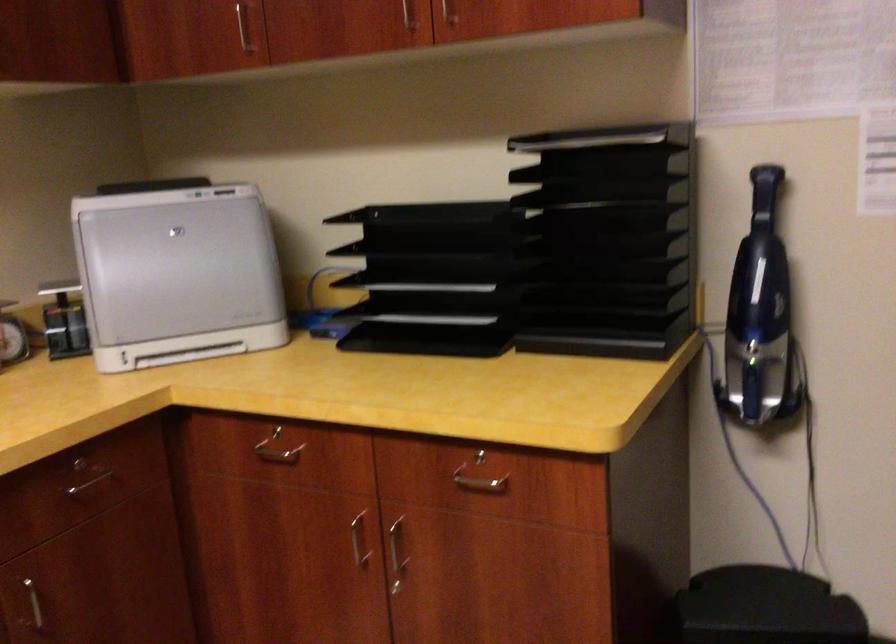
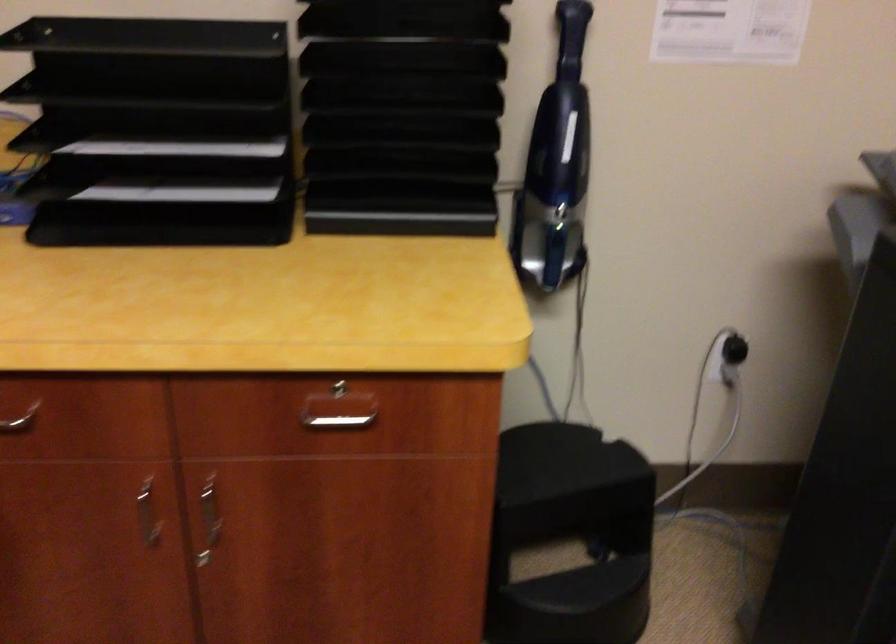
The point at (440, 317) is marked in the first image. Where is the corresponding point in the second image?

(183, 191)